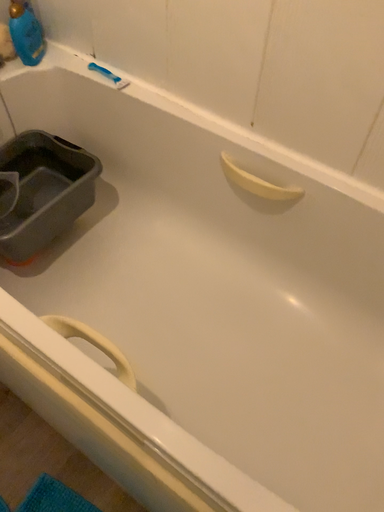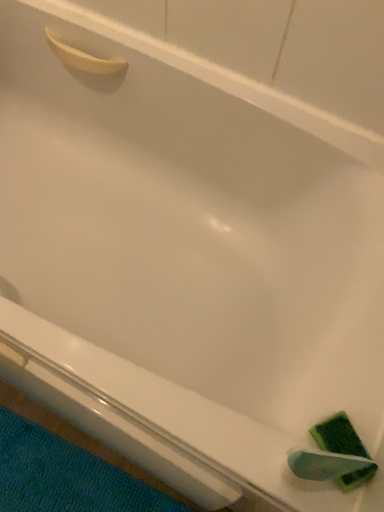
Question: Which way did the camera rotate in the video?

Choices:
 (A) rotated upward
 (B) rotated downward

Answer: (B)